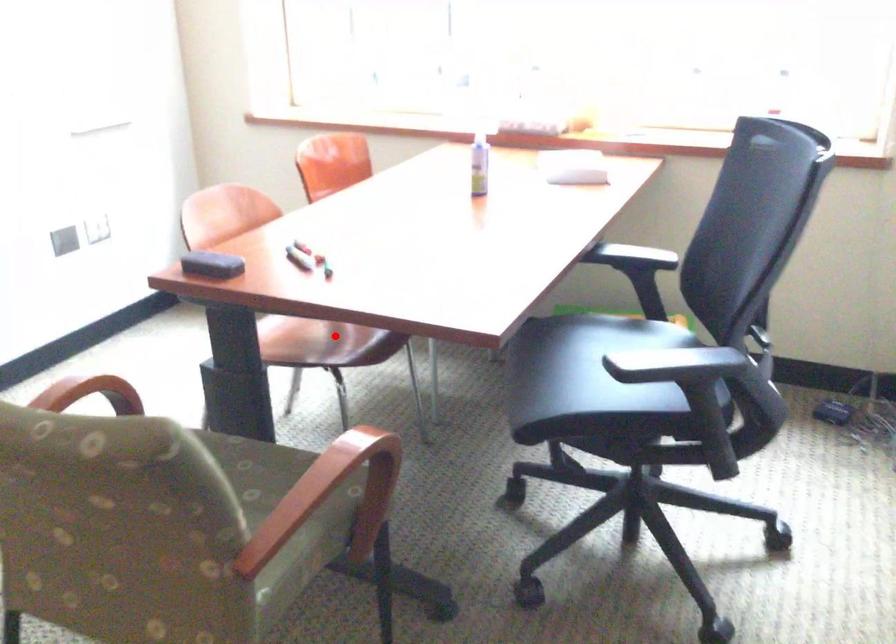
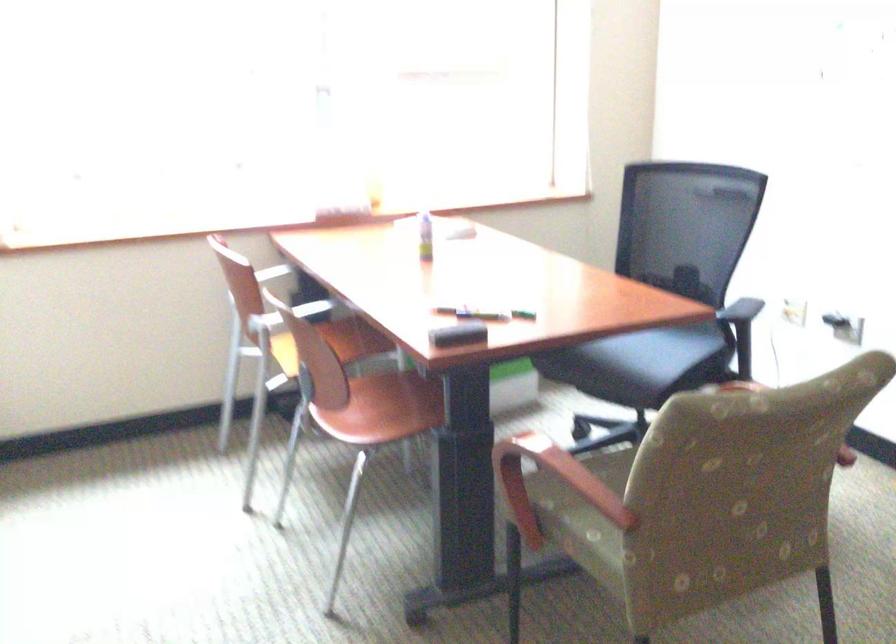
Locate, in the second image, the point that corresponds to the highlighted location in the first image.

(391, 406)